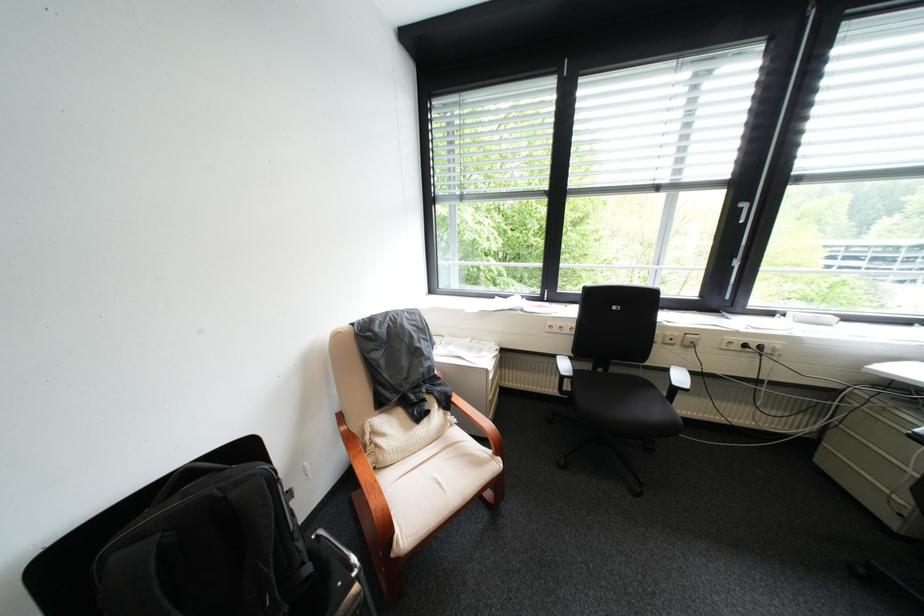
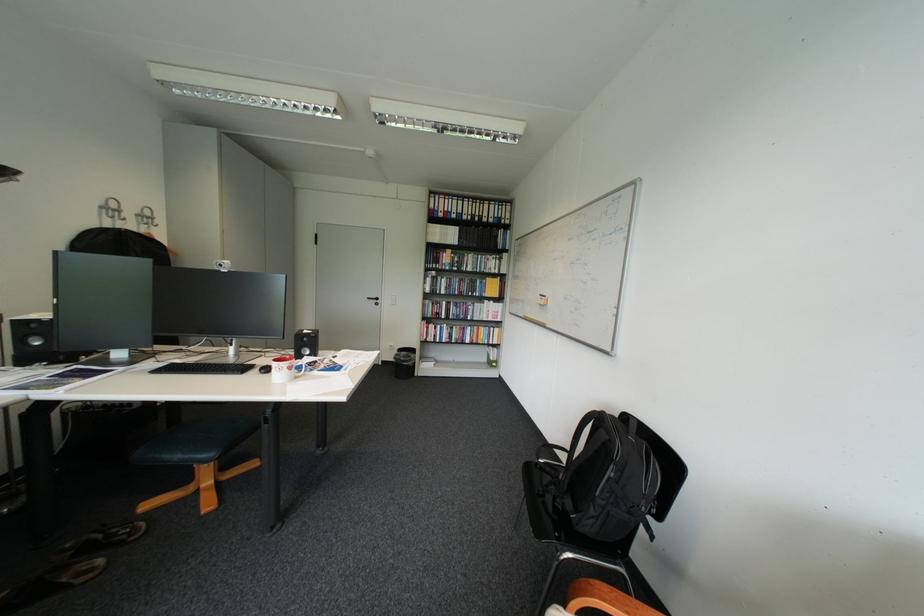
In the second image, find the point that corresponds to point (304, 533) in the first image.

(608, 496)